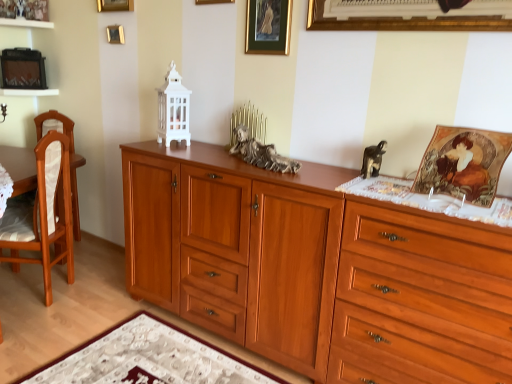
Locate an element on the screen. blank area beneath light brown wood chair at left (from a real-world perspective) is located at coordinates (27, 291).